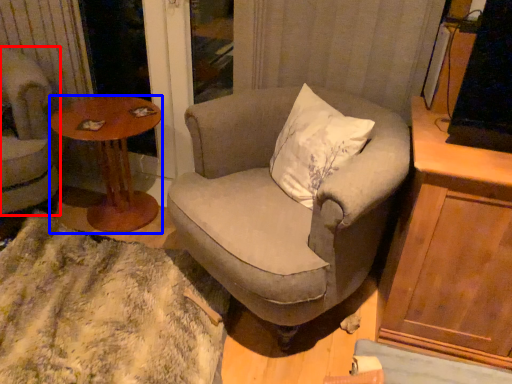
Question: Which object is further to the camera taking this photo, chair (highlighted by a red box) or coffee table (highlighted by a blue box)?

Choices:
 (A) chair
 (B) coffee table

Answer: (B)